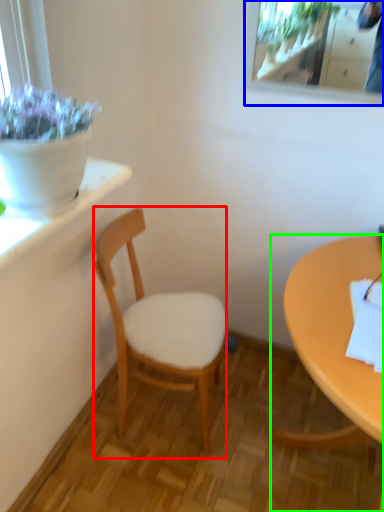
Question: Which object is positioned closest to chair (highlighted by a red box)? Select from mirror (highlighted by a blue box) and desk (highlighted by a green box).

Choices:
 (A) mirror
 (B) desk

Answer: (B)